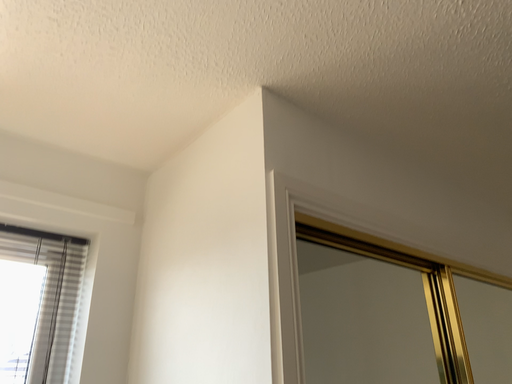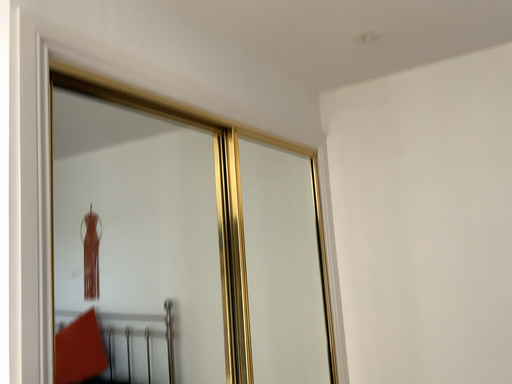
Question: How did the camera likely rotate when shooting the video?

Choices:
 (A) rotated left
 (B) rotated right

Answer: (B)